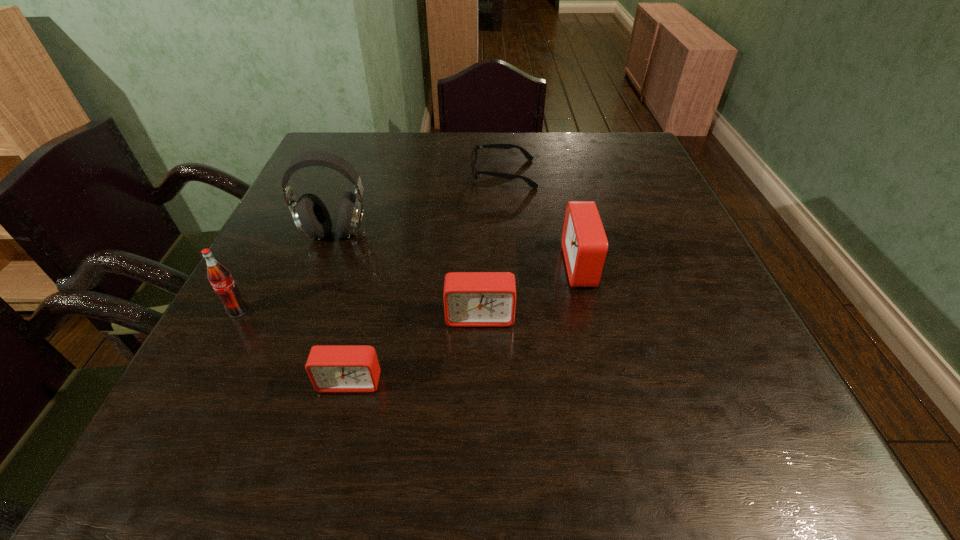
Locate an element on the screen. The width and height of the screenshot is (960, 540). headset is located at coordinates (309, 213).

Where is `vacant region located 0.080m on the front-facing side of the third shortest object`? The width and height of the screenshot is (960, 540). vacant region located 0.080m on the front-facing side of the third shortest object is located at coordinates (480, 366).

What are the coordinates of `vacant space located on the front-facing side of the third tallest object` in the screenshot? It's located at (502, 266).

Image resolution: width=960 pixels, height=540 pixels. I want to click on vacant space located on the front-facing side of the third tallest object, so click(460, 266).

At what (x,y) coordinates should I click in order to perform the action: click on free space located 0.090m on the front-facing side of the third tallest object. Please return your answer as a coordinate pair (x, y). Looking at the image, I should click on (521, 266).

Find the location of a particular element. The image size is (960, 540). free space located 0.070m on the front-facing side of the spectacles is located at coordinates (445, 173).

Identify the location of vacant space located 0.210m on the front-facing side of the spectacles. This screenshot has height=540, width=960. (394, 173).

The width and height of the screenshot is (960, 540). I want to click on vacant space situated 0.170m on the front-facing side of the spectacles, so click(x=408, y=173).

Where is `free space located 0.090m on the label of the leftmost object`? The image size is (960, 540). free space located 0.090m on the label of the leftmost object is located at coordinates (214, 358).

The image size is (960, 540). Identify the location of free space located 0.060m on the ear cups of the tallest object. (323, 267).